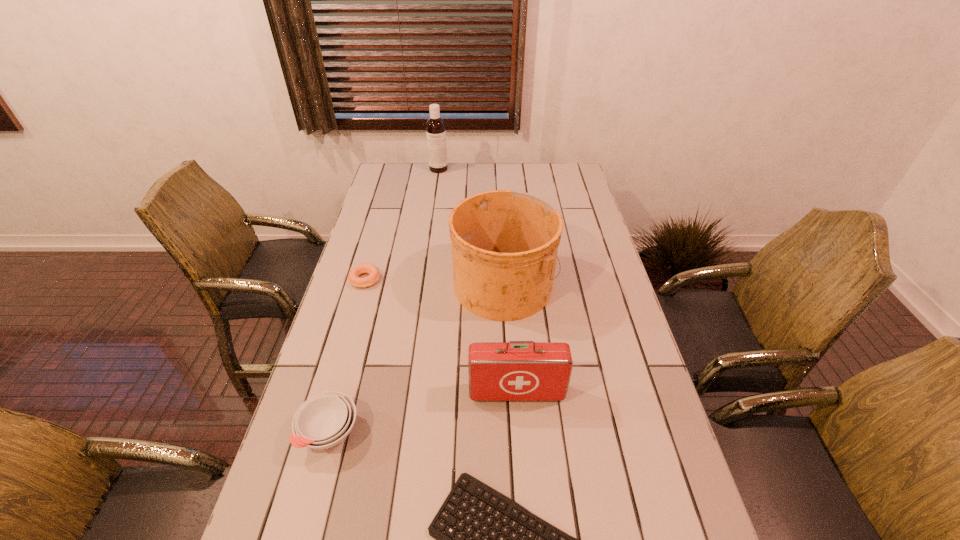
Find the location of a particular element. This screenshot has width=960, height=540. the farthest object is located at coordinates (435, 126).

Find the location of a particular element. The width and height of the screenshot is (960, 540). the third object from left to right is located at coordinates [x=435, y=126].

In order to click on bucket in this screenshot , I will do `click(504, 243)`.

Image resolution: width=960 pixels, height=540 pixels. What are the coordinates of `the third nearest object` in the screenshot? It's located at (515, 370).

Where is `the third tallest object`? This screenshot has width=960, height=540. the third tallest object is located at coordinates (515, 370).

The image size is (960, 540). I want to click on the second nearest object, so click(x=324, y=420).

The width and height of the screenshot is (960, 540). I want to click on the fourth tallest object, so click(324, 420).

This screenshot has width=960, height=540. I want to click on the fifth tallest object, so click(x=372, y=270).

I want to click on free space located 0.180m on the label side of the dishwasher detergent, so click(435, 195).

What are the coordinates of `vacant space situated 0.150m on the back of the bucket` in the screenshot? It's located at (500, 227).